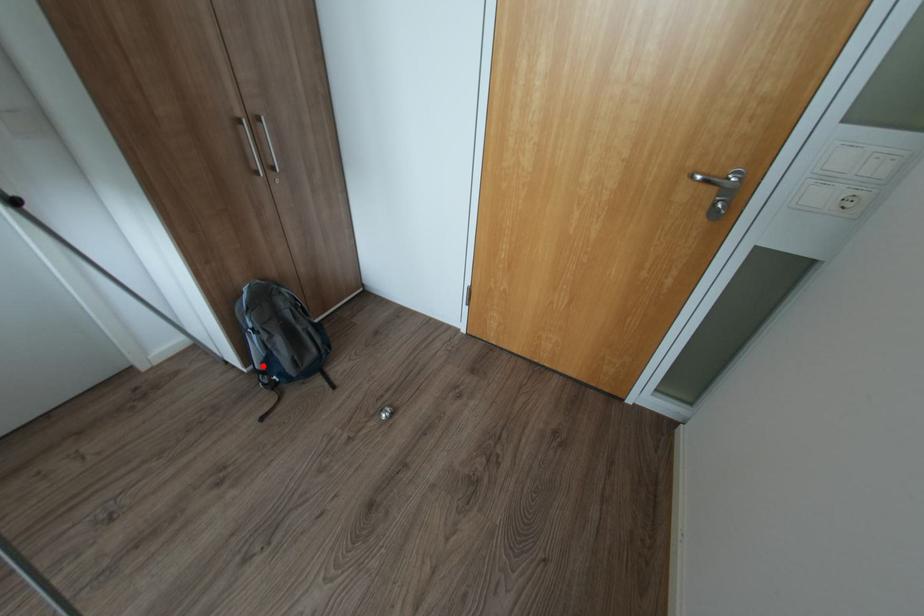
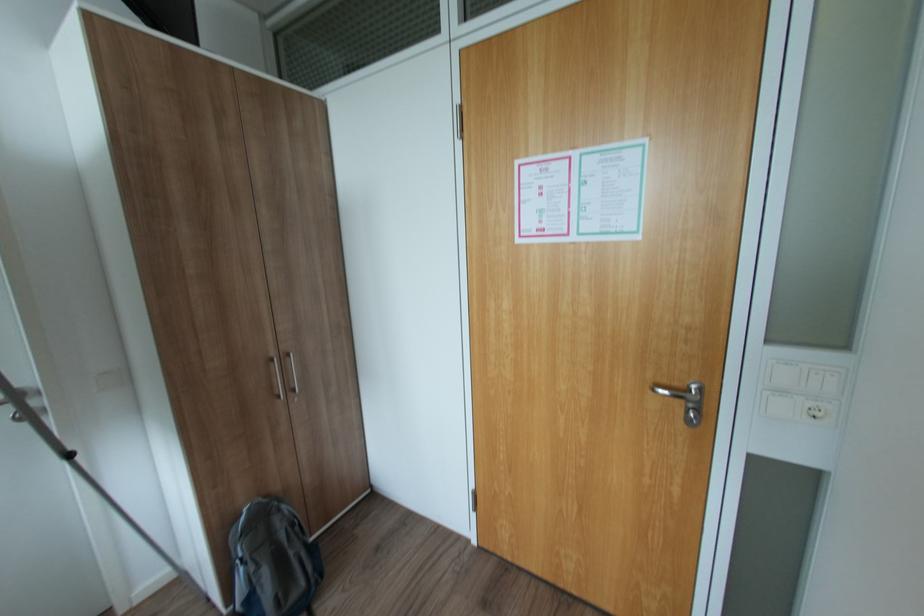
Question: I am providing you with two images of the same scene from different viewpoints. Image1 has a red point marked. In image2, the corresponding 3D location appears at what relative position? Reply with the corresponding letter.

Choices:
 (A) Closer
 (B) Farther

Answer: (A)